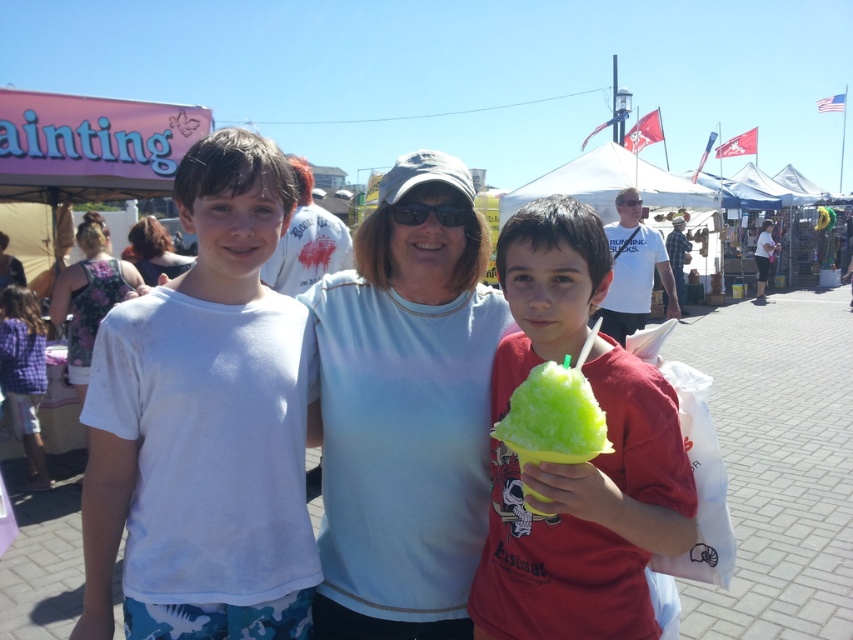
Question: Which object is positioned closest to the green matte snow cone at center?

Choices:
 (A) purple checkered shirt at left
 (B) black plastic sunglasses at center
 (C) floral fabric dress at center

Answer: (B)

Question: Based on their relative distances, which object is nearer to the green matte snow cone at center?

Choices:
 (A) green matte ice cream cone at right
 (B) floral fabric dress at center
 (C) white cotton shirt at left
 (D) purple checkered shirt at left

Answer: (A)

Question: Observing the image, what is the correct spatial positioning of green matte snow cone at center in reference to green matte ice cream cone at right?

Choices:
 (A) right
 (B) left

Answer: (A)

Question: Observing the image, what is the correct spatial positioning of white cotton shirt at left in reference to green matte snow cone at center?

Choices:
 (A) left
 (B) right

Answer: (A)

Question: Is white cotton shirt at left positioned at the back of purple checkered shirt at left?

Choices:
 (A) yes
 (B) no

Answer: (B)

Question: Which point is closer to the camera taking this photo?

Choices:
 (A) (616, 602)
 (B) (138, 268)
 (C) (131, 637)

Answer: (A)